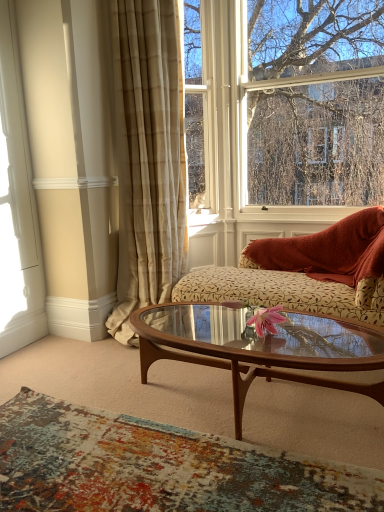
Question: Is beige plaid curtain at center smaller than white wood window frame at left?

Choices:
 (A) no
 (B) yes

Answer: (A)

Question: Is beige plaid curtain at center placed right next to white wood window frame at left?

Choices:
 (A) no
 (B) yes

Answer: (A)

Question: Is beige plaid curtain at center positioned in front of white wood window frame at left?

Choices:
 (A) no
 (B) yes

Answer: (B)

Question: Can you confirm if beige plaid curtain at center is bigger than white wood window frame at left?

Choices:
 (A) no
 (B) yes

Answer: (B)

Question: Does beige plaid curtain at center appear on the right side of white wood window frame at left?

Choices:
 (A) no
 (B) yes

Answer: (B)

Question: From their relative heights in the image, would you say beige plaid curtain at center is taller or shorter than wooden glass coffee table at center?

Choices:
 (A) short
 (B) tall

Answer: (B)

Question: From the image's perspective, is beige plaid curtain at center above or below wooden glass coffee table at center?

Choices:
 (A) above
 (B) below

Answer: (A)

Question: Is beige plaid curtain at center bigger or smaller than wooden glass coffee table at center?

Choices:
 (A) big
 (B) small

Answer: (A)

Question: Does point (165, 96) appear closer or farther from the camera than point (198, 305)?

Choices:
 (A) farther
 (B) closer

Answer: (A)

Question: Based on their positions, is beige plaid curtain at center located to the left or right of floral-patterned fabric couch at center?

Choices:
 (A) right
 (B) left

Answer: (B)

Question: Is beige plaid curtain at center inside or outside of floral-patterned fabric couch at center?

Choices:
 (A) outside
 (B) inside

Answer: (A)

Question: Considering the positions of beige plaid curtain at center and floral-patterned fabric couch at center in the image, is beige plaid curtain at center bigger or smaller than floral-patterned fabric couch at center?

Choices:
 (A) big
 (B) small

Answer: (A)

Question: From a real-world perspective, is beige plaid curtain at center above or below floral-patterned fabric couch at center?

Choices:
 (A) below
 (B) above

Answer: (B)

Question: Choose the correct answer: Is textured rug at lower center inside beige plaid curtain at center or outside it?

Choices:
 (A) inside
 (B) outside

Answer: (B)

Question: Is textured rug at lower center to the left or to the right of beige plaid curtain at center in the image?

Choices:
 (A) right
 (B) left

Answer: (A)